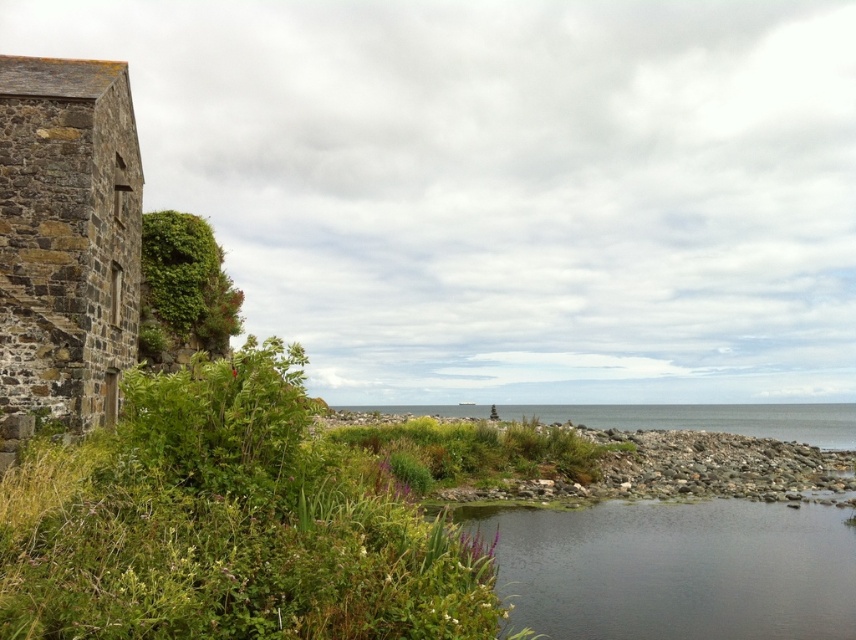
Is point (749, 576) positioned behind point (395, 404)?

No, (749, 576) is closer to viewer.

Does clear water at lower center appear on the left side of clear water at center?

Indeed, clear water at lower center is positioned on the left side of clear water at center.

Which is in front, point (851, 531) or point (788, 416)?

Point (851, 531) is in front.

The height and width of the screenshot is (640, 856). In order to click on clear water at lower center in this screenshot , I will do `click(675, 570)`.